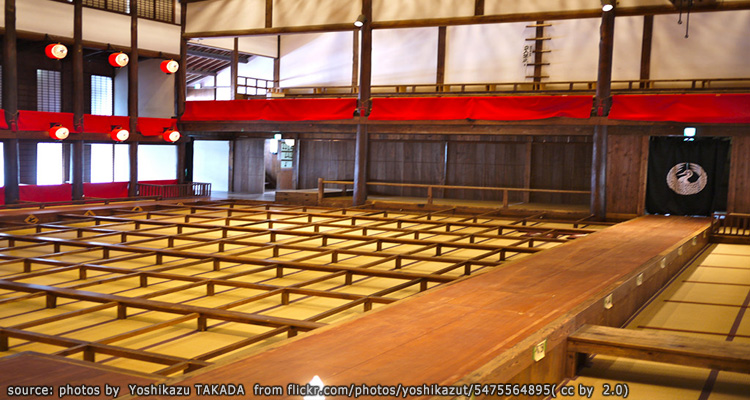
The image size is (750, 400). I want to click on lantern, so [124, 60].